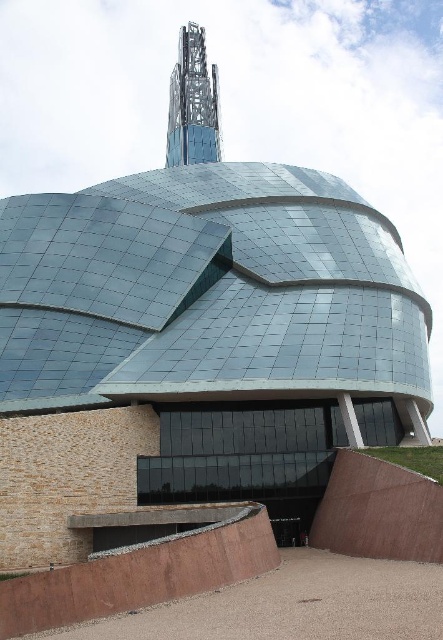
Question: Estimate the real-world distances between objects in this image. Which object is farther from the brown textured ramp at lower center?

Choices:
 (A) brown concrete ramp at lower center
 (B) glassy steel tower at upper center

Answer: (B)

Question: Estimate the real-world distances between objects in this image. Which object is closer to the brown textured ramp at lower center?

Choices:
 (A) brown concrete ramp at lower center
 (B) glassy steel tower at upper center

Answer: (A)

Question: Does brown concrete ramp at lower center have a greater width compared to glassy steel tower at upper center?

Choices:
 (A) no
 (B) yes

Answer: (A)

Question: Can you confirm if brown textured ramp at lower center is positioned above glassy steel tower at upper center?

Choices:
 (A) no
 (B) yes

Answer: (A)

Question: Does brown textured ramp at lower center have a greater width compared to glassy steel tower at upper center?

Choices:
 (A) yes
 (B) no

Answer: (B)

Question: Which of these objects is positioned farthest from the glassy steel tower at upper center?

Choices:
 (A) brown concrete ramp at lower center
 (B) brown textured ramp at lower center

Answer: (A)